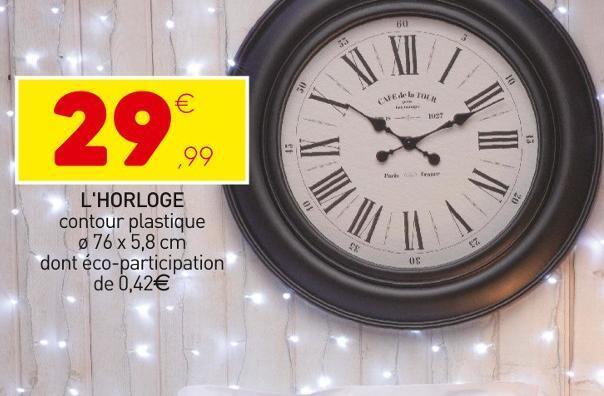
Where is `white clock face`? white clock face is located at coordinates (362, 98).